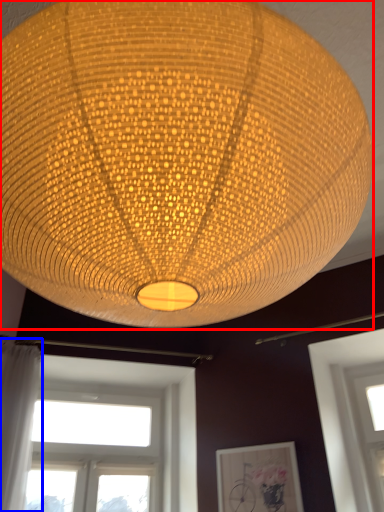
Question: Which of the following is the farthest to the observer, lamp (highlighted by a red box) or curtain (highlighted by a blue box)?

Choices:
 (A) lamp
 (B) curtain

Answer: (B)